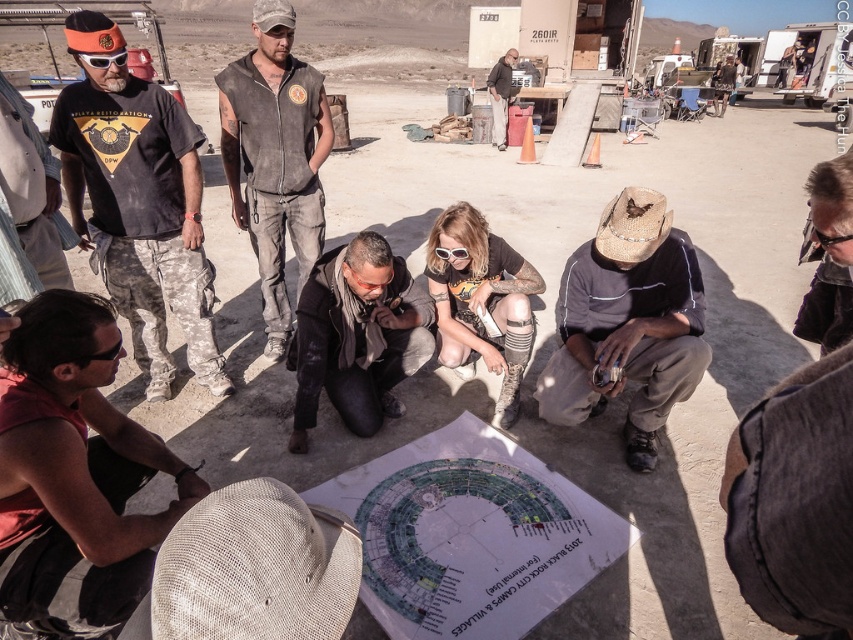
Question: Among these points, which one is farthest from the camera?

Choices:
 (A) (636, 317)
 (B) (811, 234)
 (C) (0, 83)
 (D) (497, 76)

Answer: (D)

Question: Is reddish-brown fabric at lower left to the left of black rubber goggles at lower right from the viewer's perspective?

Choices:
 (A) no
 (B) yes

Answer: (B)

Question: Which of the following is the closest to the observer?

Choices:
 (A) (47, 554)
 (B) (445, 253)
 (C) (331, 365)

Answer: (A)

Question: Which of these objects is positioned closest to the white plastic goggles at center?

Choices:
 (A) black leather boots at center
 (B) gray fabric shirt at lower right
 (C) dark gray hoodie at center

Answer: (A)

Question: Can you confirm if black leather boots at center is positioned above matte black goggles at upper left?

Choices:
 (A) no
 (B) yes

Answer: (A)

Question: Does black leather boots at center appear over matte black goggles at upper left?

Choices:
 (A) yes
 (B) no

Answer: (B)